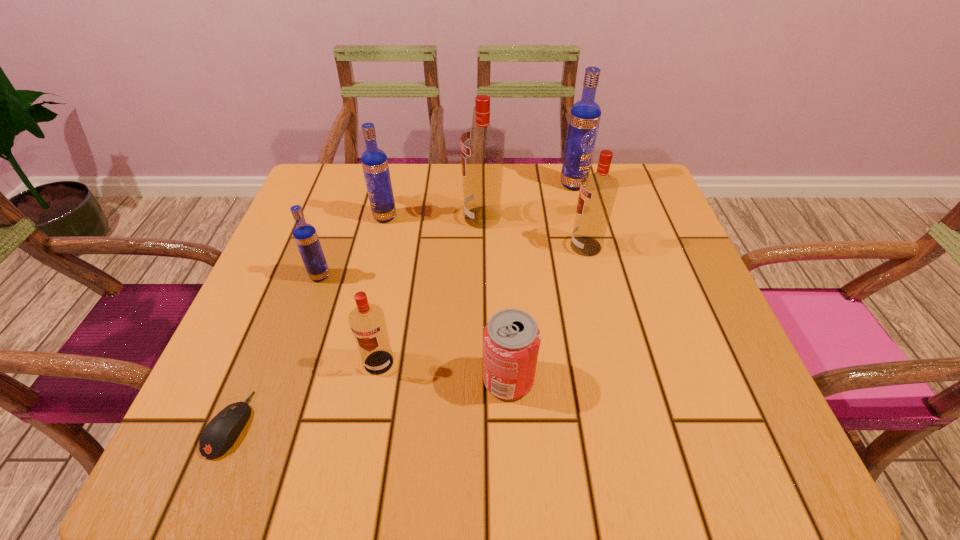
Identify which vodka is the third nearest to the nearest vodka. Please provide its 2D coordinates. Your answer should be formatted as a tuple, i.e. [(x, y)], where the tuple contains the x and y coordinates of a point satisfying the conditions above.

[(374, 161)]

I want to click on blue vodka that can be found as the closest to the soda can, so click(x=305, y=235).

Find the location of a particular element. The width and height of the screenshot is (960, 540). blue vodka object that ranks as the third closest to the farthest red vodka is located at coordinates (305, 235).

Identify which red vodka is the closest to the nearest red vodka. Please provide its 2D coordinates. Your answer should be formatted as a tuple, i.e. [(x, y)], where the tuple contains the x and y coordinates of a point satisfying the conditions above.

[(482, 146)]

At what (x,y) coordinates should I click in order to perform the action: click on red vodka identified as the second closest to the fourth vodka from left to right. Please return your answer as a coordinate pair (x, y). The height and width of the screenshot is (540, 960). Looking at the image, I should click on click(367, 321).

Find the location of a particular element. vacant region that satisfies the following two spatial constraints: 1. on the front label of the nearest red vodka; 2. on the left side of the seventh tallest object is located at coordinates (375, 379).

At what (x,y) coordinates should I click in order to perform the action: click on vacant region that satisfies the following two spatial constraints: 1. on the front label of the second biggest red vodka; 2. on the front label of the nearest vodka. Please return your answer as a coordinate pair (x, y). Looking at the image, I should click on (614, 362).

Where is `free spot that satisfies the following two spatial constraints: 1. on the front label of the second shortest object; 2. on the left side of the second red vodka from right to left`? free spot that satisfies the following two spatial constraints: 1. on the front label of the second shortest object; 2. on the left side of the second red vodka from right to left is located at coordinates (483, 379).